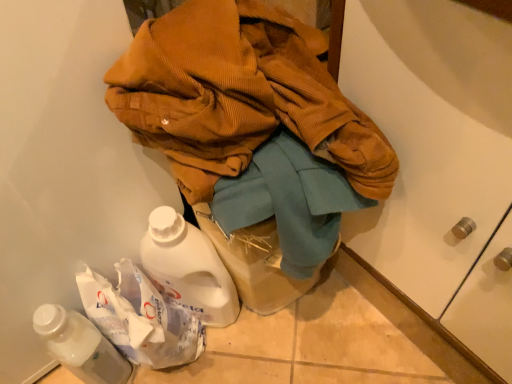
Question: Considering their positions, is white plastic bottle at lower left located in front of or behind brown corduroy jacket at center?

Choices:
 (A) front
 (B) behind

Answer: (B)

Question: From the image's perspective, is white plastic bottle at lower left positioned above or below brown corduroy jacket at center?

Choices:
 (A) above
 (B) below

Answer: (B)

Question: In terms of width, does white plastic bottle at lower left look wider or thinner when compared to brown corduroy jacket at center?

Choices:
 (A) wide
 (B) thin

Answer: (B)

Question: Is brown corduroy jacket at center in front of or behind white plastic bottle at lower left in the image?

Choices:
 (A) behind
 (B) front

Answer: (B)

Question: Does point (172, 54) appear closer or farther from the camera than point (77, 317)?

Choices:
 (A) closer
 (B) farther

Answer: (A)

Question: Is brown corduroy jacket at center spatially inside white plastic bottle at lower left, or outside of it?

Choices:
 (A) inside
 (B) outside

Answer: (B)

Question: Is brown corduroy jacket at center bigger or smaller than white plastic bottle at lower left?

Choices:
 (A) big
 (B) small

Answer: (A)